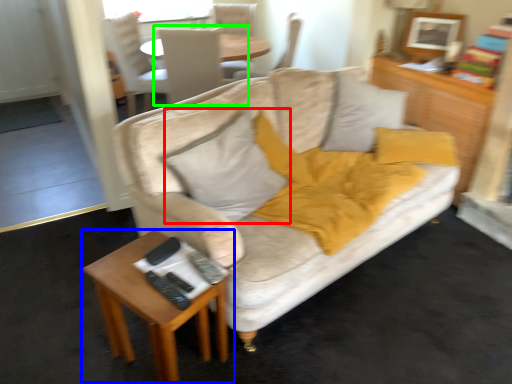
Question: Estimate the real-world distances between objects in this image. Which object is farther from pillow (highlighted by a red box), table (highlighted by a blue box) or chair (highlighted by a green box)?

Choices:
 (A) table
 (B) chair

Answer: (B)